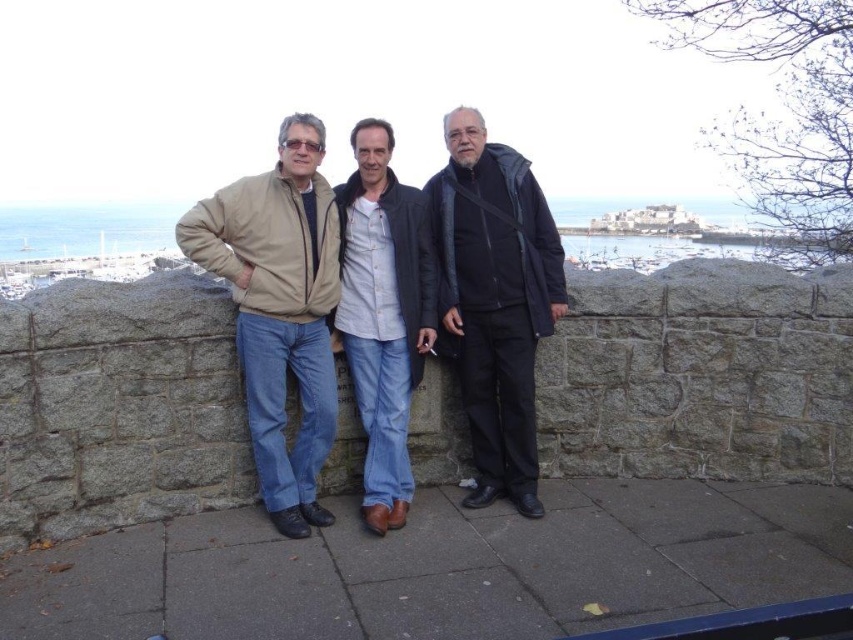
Question: Can you confirm if matte beige jacket at center is smaller than light blue denim jeans at center?

Choices:
 (A) yes
 (B) no

Answer: (B)

Question: Which point appears closest to the camera in this image?

Choices:
 (A) (367, 412)
 (B) (233, 276)
 (C) (457, 288)

Answer: (B)

Question: Which point appears closest to the camera in this image?

Choices:
 (A) (524, 417)
 (B) (287, 456)
 (C) (402, 451)

Answer: (B)

Question: Is matte beige jacket at center in front of beige fabric jacket at left?

Choices:
 (A) no
 (B) yes

Answer: (A)

Question: Which object is positioned farthest from the matte beige jacket at center?

Choices:
 (A) beige fabric jacket at left
 (B) dark gray fabric jacket at center

Answer: (B)

Question: Is beige fabric jacket at left positioned before dark gray fabric jacket at center?

Choices:
 (A) yes
 (B) no

Answer: (A)